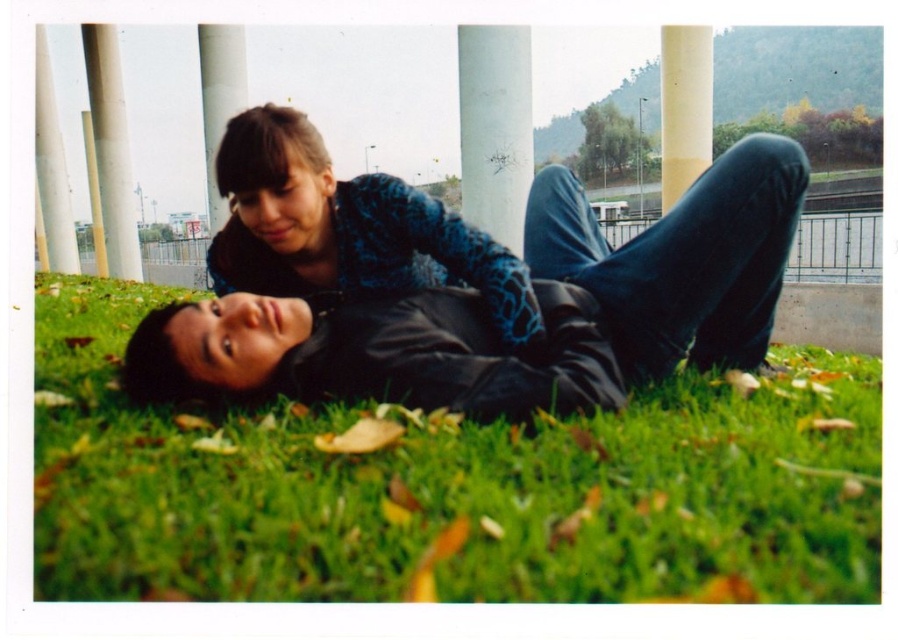
Question: Can you confirm if white matte pillar at center is smaller than yellow matte pillar at upper center?

Choices:
 (A) yes
 (B) no

Answer: (A)

Question: Does green grass at center have a lesser width compared to white smooth pillar at upper center?

Choices:
 (A) no
 (B) yes

Answer: (B)

Question: Based on their relative distances, which object is nearer to the white concrete pillar at upper left?

Choices:
 (A) white matte pillar at center
 (B) black leather jacket at lower left
 (C) green grass at center

Answer: (A)

Question: Can you confirm if white matte pillar at center is positioned to the right of white smooth pillar at upper left?

Choices:
 (A) no
 (B) yes

Answer: (B)

Question: Among these points, which one is farthest from the camera?

Choices:
 (A) (663, 184)
 (B) (37, 198)
 (C) (94, 120)
 (D) (791, 499)

Answer: (B)

Question: Based on their relative distances, which object is nearer to the white smooth pillar at upper center?

Choices:
 (A) yellow matte pillar at upper center
 (B) white smooth pillar at upper left
 (C) white concrete pillar at upper left
 (D) blue textured sweater at upper center

Answer: (D)